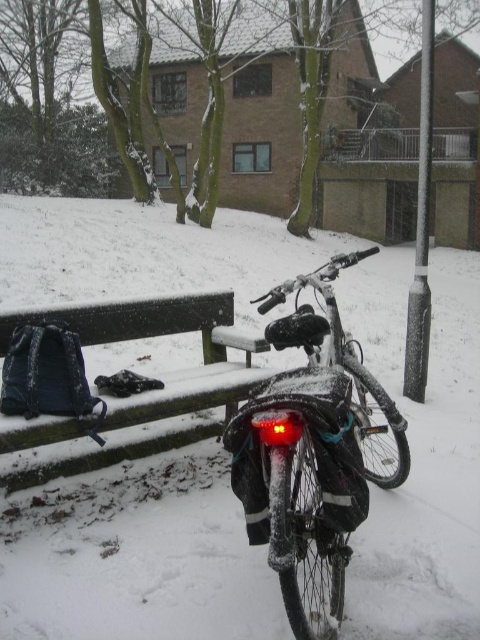
Question: Where is shiny metallic bicycle at center located in relation to sleek metallic pole at right in the image?

Choices:
 (A) below
 (B) above

Answer: (A)

Question: Which point appears closest to the camera in this image?

Choices:
 (A) (257, 289)
 (B) (282, 378)

Answer: (B)

Question: Which point appears farthest from the camera in this image?

Choices:
 (A) (9, 598)
 (B) (412, 392)
 (C) (178, 324)

Answer: (B)

Question: Which point is farther to the camera?

Choices:
 (A) sleek metallic pole at right
 (B) shiny metallic bicycle at center

Answer: (A)

Question: Can you confirm if shiny metallic bicycle at center is thinner than dark blue fabric bench at lower left?

Choices:
 (A) yes
 (B) no

Answer: (A)

Question: Is dark blue fabric bench at lower left thinner than sleek metallic pole at right?

Choices:
 (A) yes
 (B) no

Answer: (A)